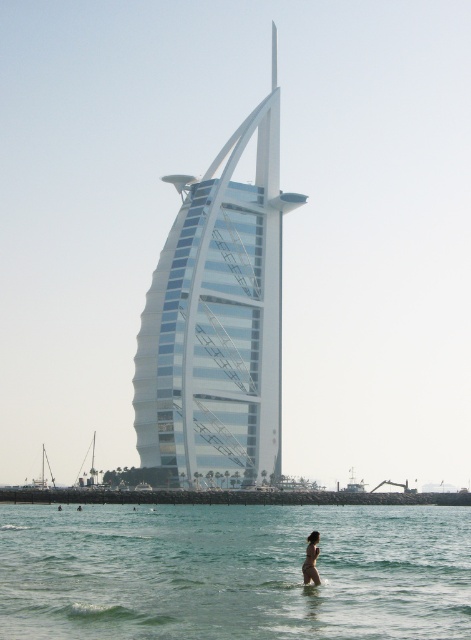
Based on the photo, you are standing on the beach near the Burj Al Arab hotel. You see the clear water at lower center and the white glass tower at center. Which object is closer to your right side?

The clear water at lower center is to the right of the white glass tower at center, so the clear water at lower center is closer to your right side.

You are a tourist standing on the beach in front of the Burj Al Arab hotel. You see the clear water at lower center and the tan skin human at lower center. Which one is bigger in size?

The clear water at lower center is larger in size than the tan skin human at lower center.

You are standing on the beach looking at the Burj Al Arab. You see the clear water at lower center and the white glass tower at center. Which object is closer to you?

The clear water at lower center is closer to you because it is in front of the white glass tower at center.